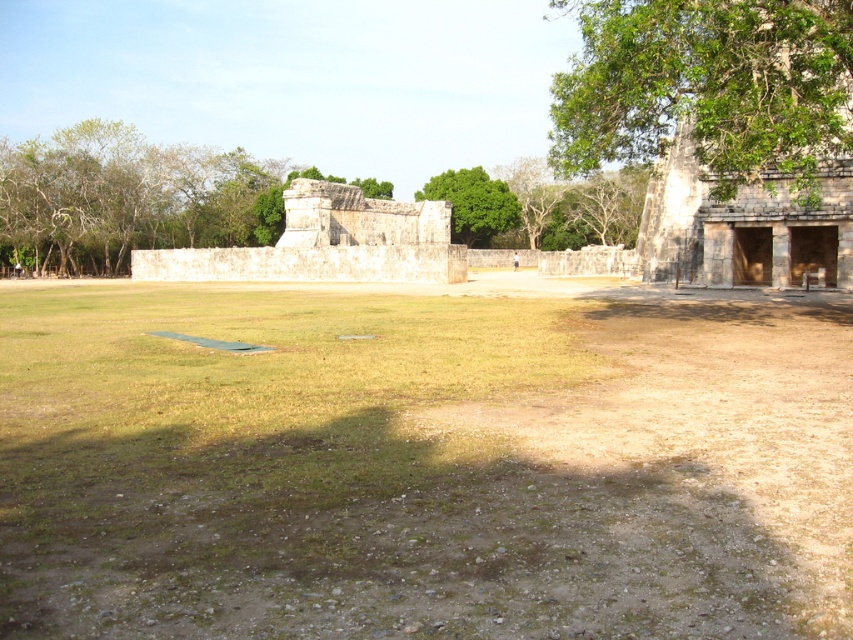
Can you confirm if brown/dry soil at center is positioned below green leafy tree at center?

Indeed, brown/dry soil at center is positioned under green leafy tree at center.

Which is behind, point (787, 456) or point (447, 188)?

The point (447, 188) is behind.

The image size is (853, 640). Identify the location of brown/dry soil at center. (421, 467).

Is green leafy tree at left bigger than green leafy tree at center?

Indeed, green leafy tree at left has a larger size compared to green leafy tree at center.

Can you confirm if green leafy tree at left is taller than green leafy tree at center?

Indeed, green leafy tree at left has a greater height compared to green leafy tree at center.

Between point (112, 243) and point (483, 208), which one is positioned behind?

The point (483, 208) is behind.

You are a GUI agent. You are given a task and a screenshot of the screen. Output one action in this format:
    pyautogui.click(x=<x>, y=<y>)
    Task: Click on the green leafy tree at left
    
    Given the screenshot: What is the action you would take?
    (x=120, y=196)

Is green leafy tree at left bigger than stone/brick ruins at right?

Yes.

Find the location of `green leafy tree at left`. green leafy tree at left is located at coordinates [120, 196].